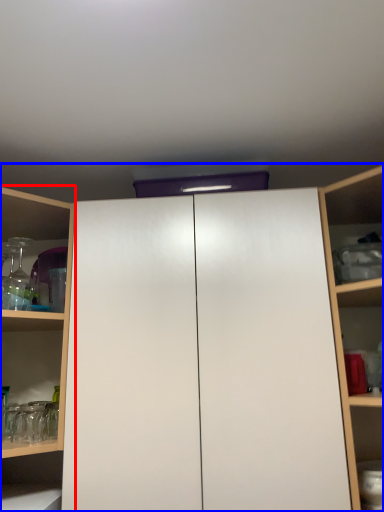
Question: Which object appears closest to the camera in this image, shelf (highlighted by a red box) or cupboard (highlighted by a blue box)?

Choices:
 (A) shelf
 (B) cupboard

Answer: (B)